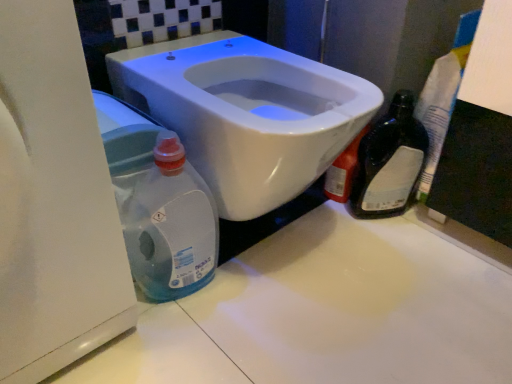
Question: Is white glossy counter top at center turned away from black glass bottle at right?

Choices:
 (A) no
 (B) yes

Answer: (A)

Question: From a real-world perspective, is white glossy counter top at center under black glass bottle at right?

Choices:
 (A) yes
 (B) no

Answer: (A)

Question: From the image's perspective, is white glossy counter top at center beneath black glass bottle at right?

Choices:
 (A) yes
 (B) no

Answer: (A)

Question: Is white glossy counter top at center to the right of black glass bottle at right from the viewer's perspective?

Choices:
 (A) yes
 (B) no

Answer: (B)

Question: Is black glass bottle at right a part of white glossy counter top at center?

Choices:
 (A) yes
 (B) no

Answer: (B)

Question: Considering the relative sizes of white glossy counter top at center and black glass bottle at right in the image provided, is white glossy counter top at center thinner than black glass bottle at right?

Choices:
 (A) yes
 (B) no

Answer: (B)

Question: Considering the relative sizes of white glossy toilet at center and translucent plastic bottle at lower left in the image provided, is white glossy toilet at center thinner than translucent plastic bottle at lower left?

Choices:
 (A) yes
 (B) no

Answer: (B)

Question: From a real-world perspective, does white glossy toilet at center stand above translucent plastic bottle at lower left?

Choices:
 (A) no
 (B) yes

Answer: (B)

Question: Can you confirm if white glossy toilet at center is shorter than translucent plastic bottle at lower left?

Choices:
 (A) yes
 (B) no

Answer: (B)

Question: Is white glossy toilet at center positioned behind translucent plastic bottle at lower left?

Choices:
 (A) no
 (B) yes

Answer: (A)

Question: Does white glossy toilet at center turn towards translucent plastic bottle at lower left?

Choices:
 (A) no
 (B) yes

Answer: (A)

Question: Would you say white glossy toilet at center contains translucent plastic bottle at lower left?

Choices:
 (A) yes
 (B) no

Answer: (B)

Question: Does translucent plastic bottle at lower left have a greater width compared to white glossy counter top at center?

Choices:
 (A) yes
 (B) no

Answer: (B)